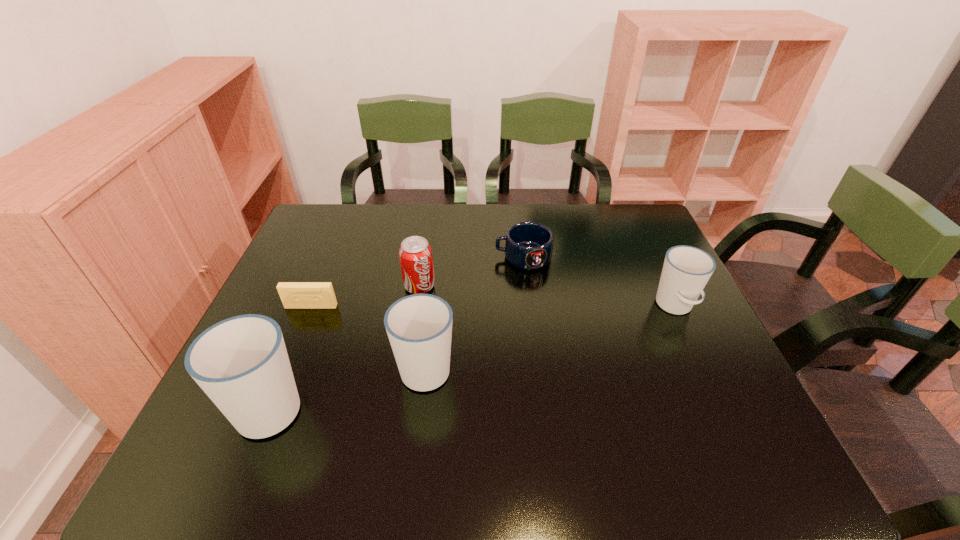
Identify the location of vacant space situated on the right of the soda. This screenshot has width=960, height=540. (580, 286).

Where is `object that is at the far edge`? The height and width of the screenshot is (540, 960). object that is at the far edge is located at coordinates (528, 245).

This screenshot has width=960, height=540. Find the location of `cup located at the left edge`. cup located at the left edge is located at coordinates (241, 363).

Identify the location of videotape that is at the left edge. The width and height of the screenshot is (960, 540). (294, 295).

The image size is (960, 540). In order to click on object that is at the right edge in this screenshot , I will do `click(686, 270)`.

Where is `object that is at the near left corner`? Image resolution: width=960 pixels, height=540 pixels. object that is at the near left corner is located at coordinates (241, 363).

I want to click on blank space at the far edge, so click(x=464, y=244).

In the image, there is a desktop. Where is `free region at the near edge`? The image size is (960, 540). free region at the near edge is located at coordinates (474, 412).

This screenshot has width=960, height=540. In order to click on free space at the left edge of the desktop in this screenshot , I will do `click(299, 309)`.

This screenshot has width=960, height=540. In order to click on free space at the right edge in this screenshot , I will do `click(638, 262)`.